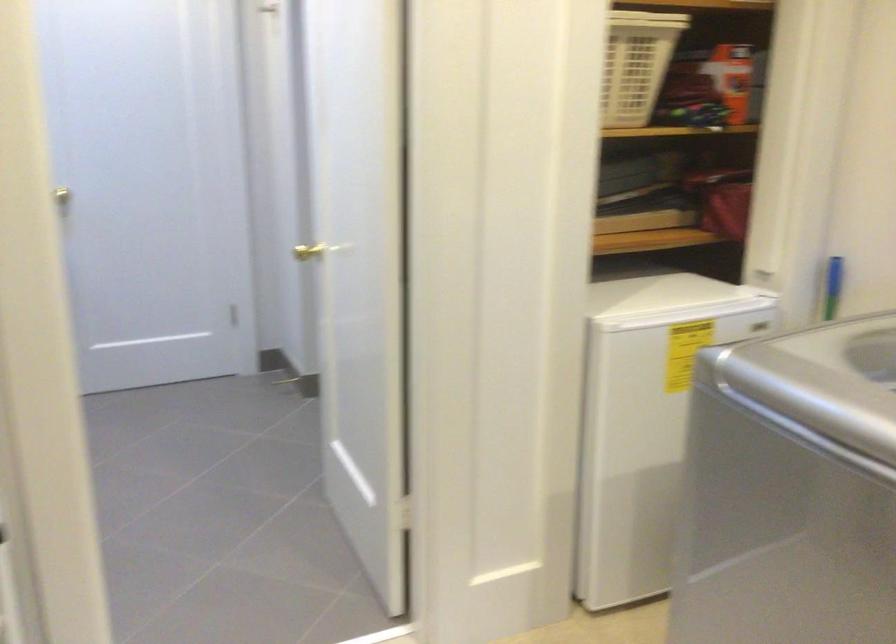
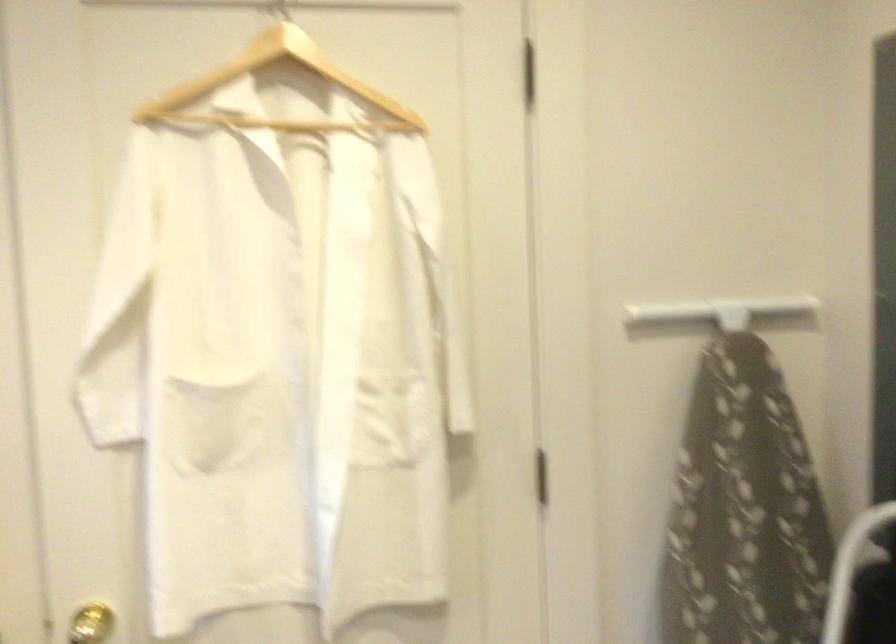
Question: How did the camera likely rotate?

Choices:
 (A) Left
 (B) Right
 (C) Up
 (D) Down

Answer: (A)